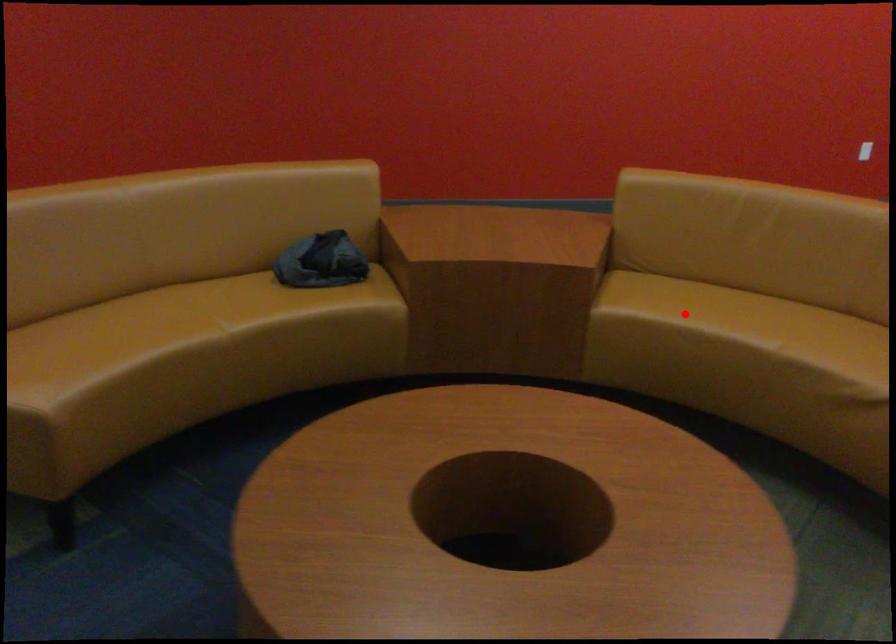
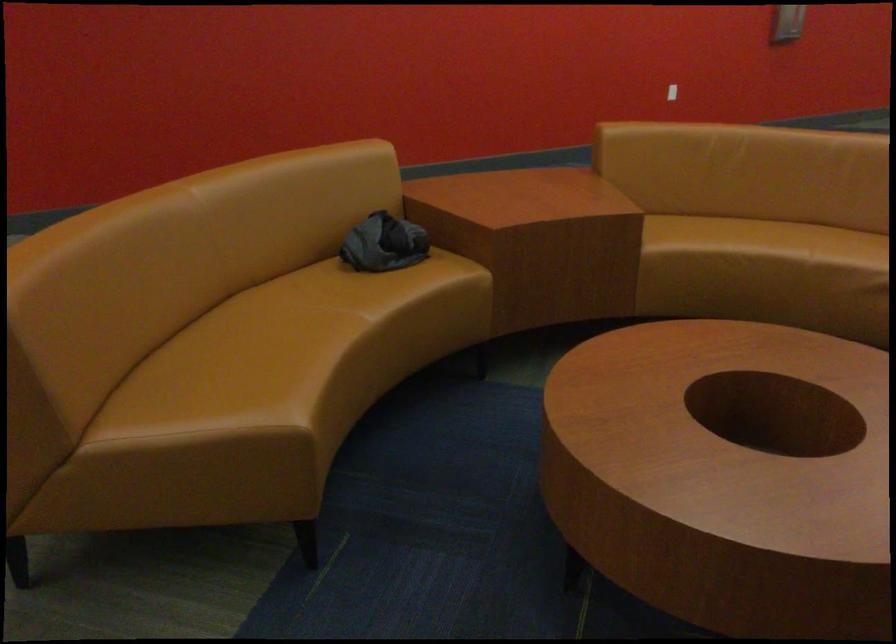
Question: I am providing you with two images of the same scene from different viewpoints. Image1 has a red point marked. In image2, the corresponding 3D location appears at what relative position? Reply with the corresponding letter.

Choices:
 (A) Closer
 (B) Farther

Answer: (B)